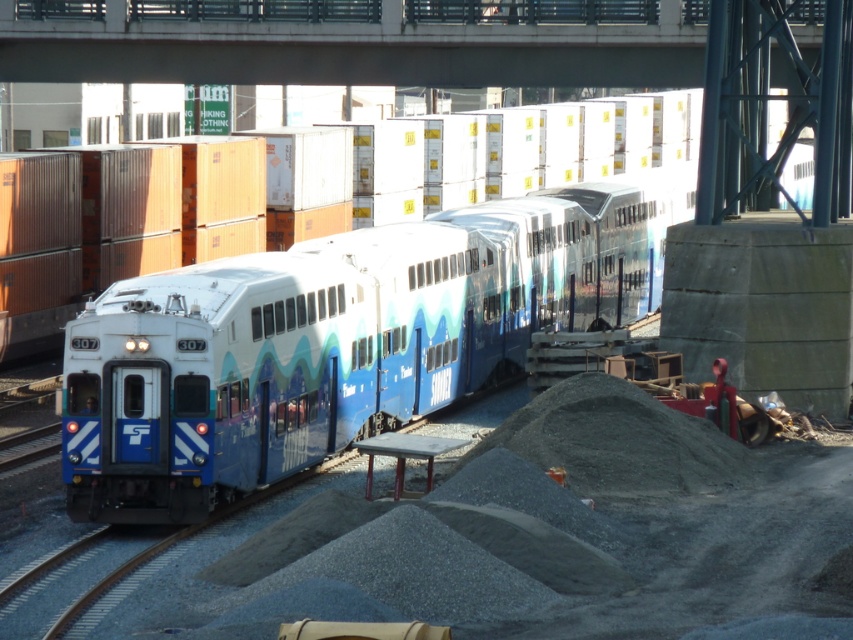
Question: Which point is closer to the camera?

Choices:
 (A) concrete at upper center
 (B) blue glossy train at center

Answer: (B)

Question: Which of the following is the closest to the observer?

Choices:
 (A) (525, 252)
 (B) (564, 80)

Answer: (B)

Question: Does blue glossy train at center have a greater width compared to concrete at upper center?

Choices:
 (A) no
 (B) yes

Answer: (A)

Question: Is blue glossy train at center thinner than concrete at upper center?

Choices:
 (A) no
 (B) yes

Answer: (B)

Question: Which of the following is the farthest from the observer?

Choices:
 (A) blue glossy train at center
 (B) concrete at upper center

Answer: (B)

Question: Is blue glossy train at center above concrete at upper center?

Choices:
 (A) no
 (B) yes

Answer: (A)